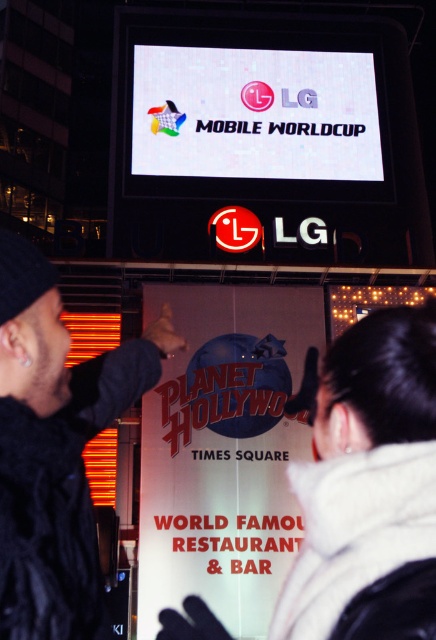
You are a photographer trying to capture both the black fuzzy hat at upper left and the white glossy screen at upper center in a single shot. Which object should you focus on first to ensure both are in frame?

The black fuzzy hat at upper left is smaller than the white glossy screen at upper center, so you should focus on the white glossy screen at upper center first to ensure both are in frame.

You are a photographer trying to capture both the white paper sign at center and the black fuzzy hat at upper left in the same frame. Based on their sizes, which object should you focus on to ensure both fit in the photo?

The white paper sign at center might be wider than black fuzzy hat at upper left, so focusing on the white paper sign at center would help ensure both fit in the photo.

Consider the image. You are standing at the base of the building where the white glossy screen at upper center is located. You want to place a new advertisement on the white paper sign at center so that it is visible from the screen. Considering the distance between them, what is the minimum height in meters that the advertisement must be to be clearly seen from the screen?

The white paper sign at center is 20.03 meters away from the white glossy screen at upper center. To ensure visibility from that distance, the advertisement should be at least 1.5 meters tall. This height is standard for signs viewed from such a distance to maintain clarity and legibility.